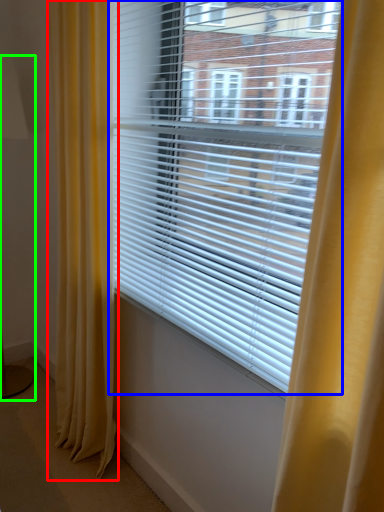
Question: Considering the real-world distances, which object is closest to curtain (highlighted by a red box)? window blind (highlighted by a blue box) or table lamp (highlighted by a green box).

Choices:
 (A) window blind
 (B) table lamp

Answer: (A)